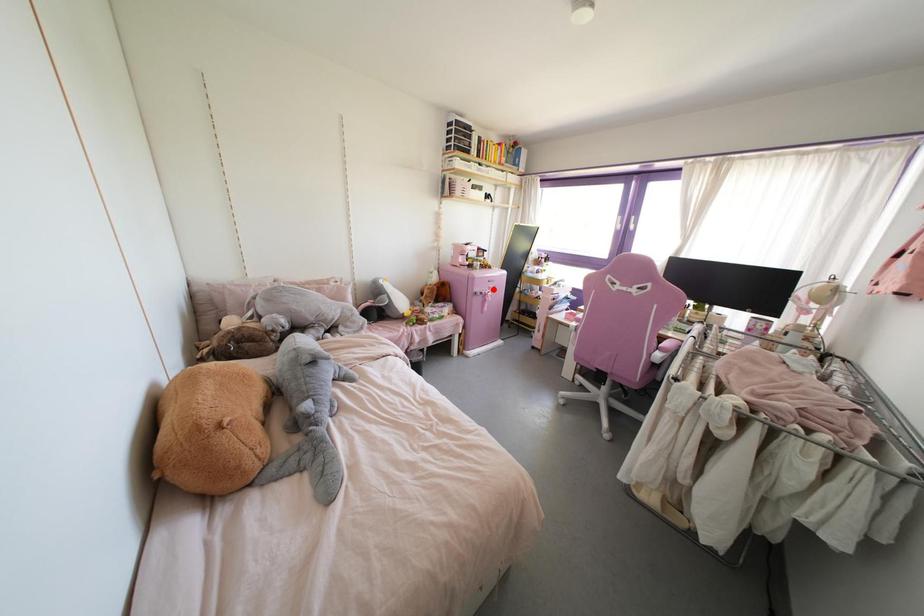
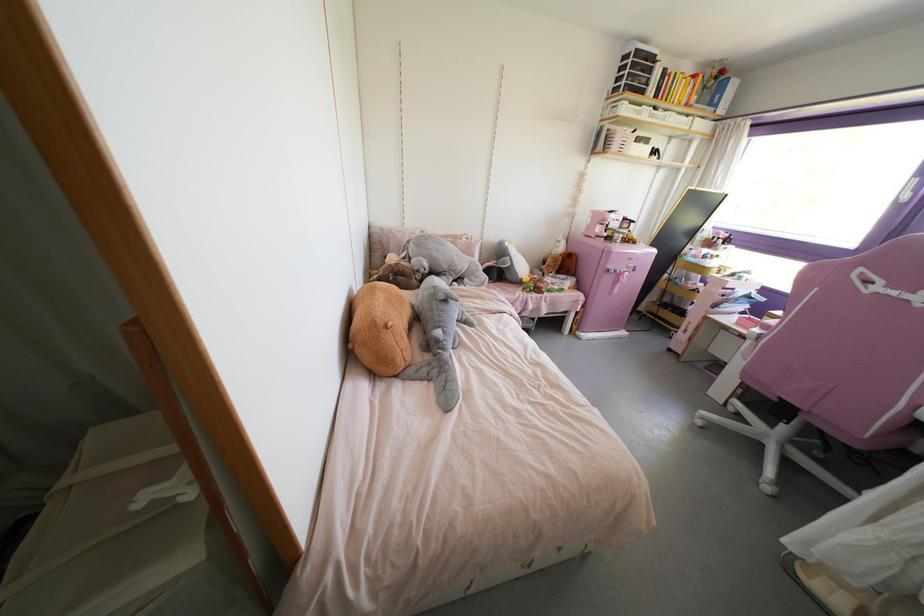
The point at the highlighted location is marked in the first image. Where is the corresponding point in the second image?

(633, 270)